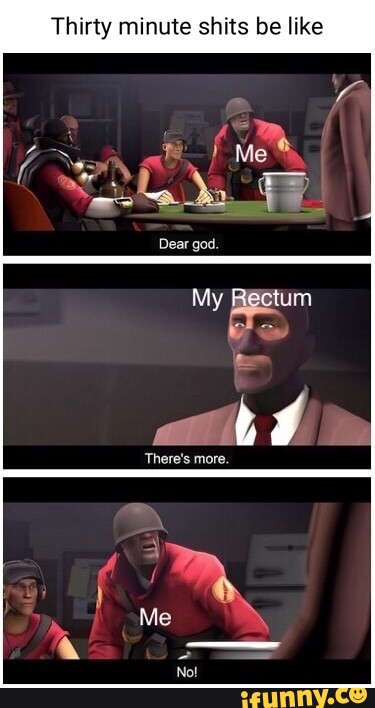
You are a GUI agent. You are given a task and a screenshot of the screen. Output one action in this format:
    pyautogui.click(x=<x>, y=<y>)
    Task: Click on the corkboard
    The image size is (375, 708).
    Given the screenshot: What is the action you would take?
    pyautogui.click(x=78, y=627), pyautogui.click(x=168, y=110)